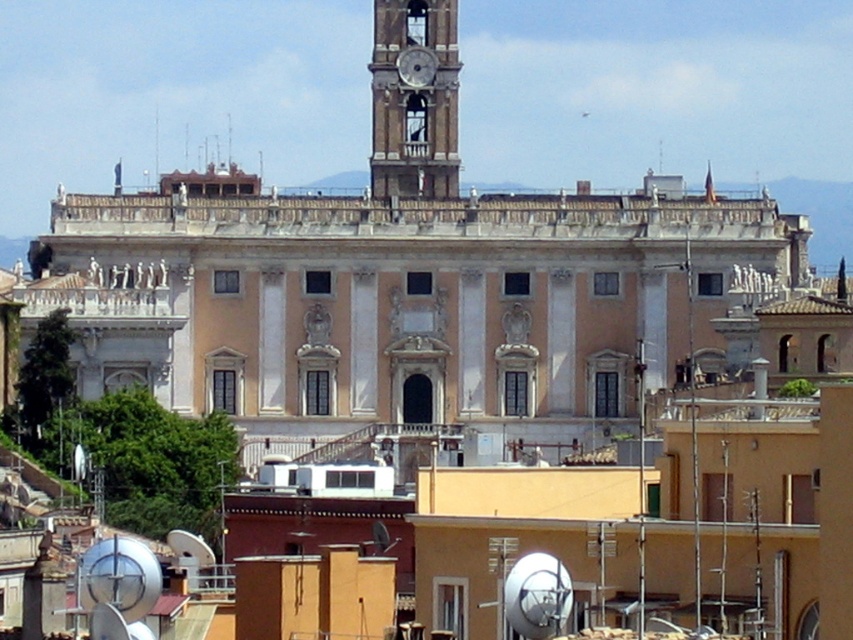
You are standing in front of the historic building and notice two points marked on its facade. The first point is located at coordinates point [395,88] and the second at point [416,76]. Which of these two points is closer to your viewpoint?

Point [395,88] is further to the camera than point [416,76], so the point closer to your viewpoint is point [416,76].

You are an architect visiting the building and want to install a new statue on the roof. The statue will be placed between the smooth stone clock tower at center and the metallic silver clock at upper center. Based on their positions, which object will the statue be closer to?

The smooth stone clock tower at center is positioned on the left side of metallic silver clock at upper center, so the statue placed between them will be closer to the metallic silver clock at upper center.